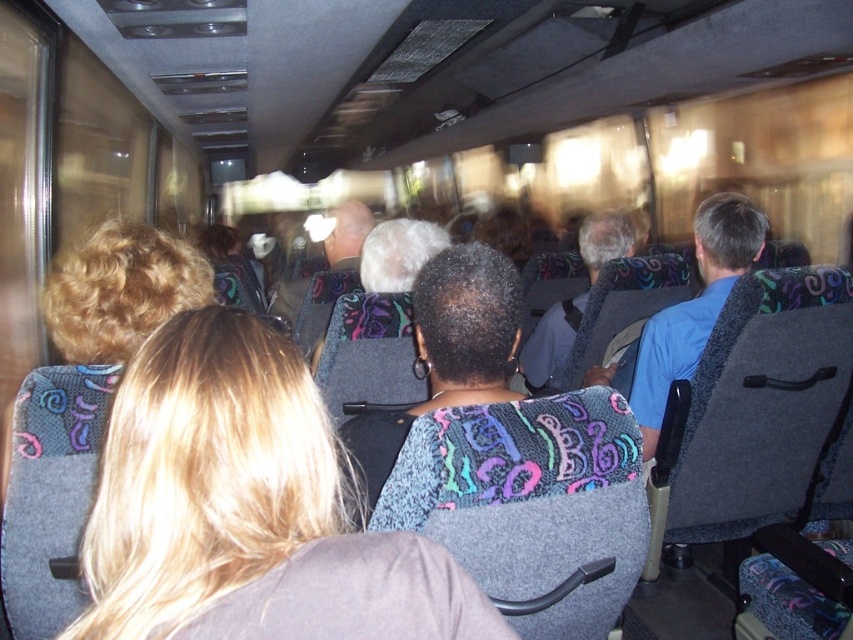
Looking at this image, you are standing at the back of the bus and want to move towards the front. There are two points marked on the floor, point 1 at coordinates point (474,388) and point 2 at coordinates point (535,333). Which point should you step on first as you move forward?

Point 1 at coordinates point (474,388) is in front of point 2 at coordinates point (535,333). Since you are moving forward towards the front of the bus, you should step on point 1 first.

You are a passenger on the bus and want to know if you can reach the overhead compartment above the seat in front of you. The overhead compartment is 1.2 meters above the seat. Your height is 1.7 meters. Considering the height of the blonde hair at center and the gray fabric jacket at center, can you determine if you can reach it?

The blonde hair at center is shorter than the gray fabric jacket at center. Since the overhead compartment is 1.2 meters above the seat and your height is 1.7 meters, you can reach it as your total height exceeds the required height.

You are a passenger on the bus and need to locate the multicolored fabric headrest at center. If you look at the point with coordinates (445, 353), will you find it there?

Yes, the point (445, 353) is on the multicolored fabric headrest at center, so you will find it there.